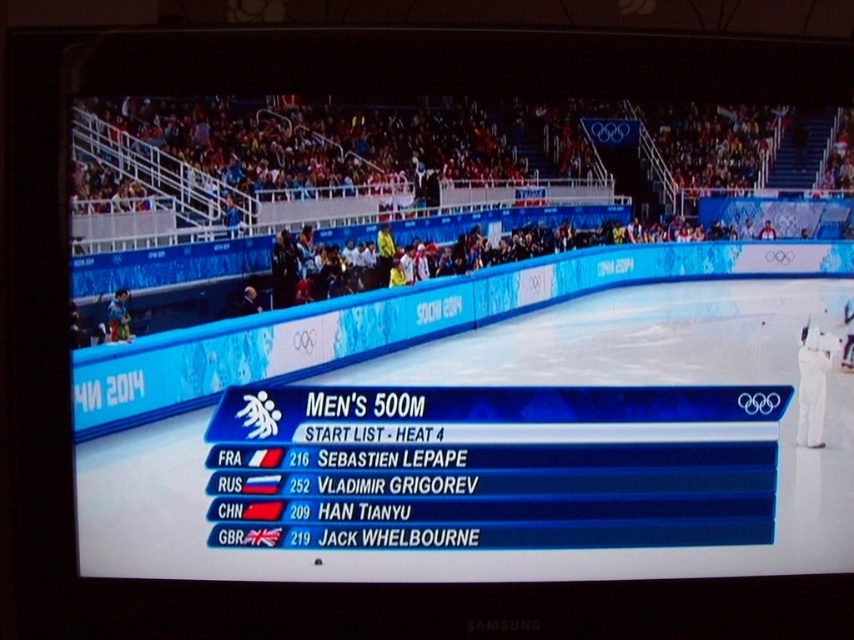
Question: Is white glossy scoreboard at center further to the viewer compared to white cotton pants at right?

Choices:
 (A) no
 (B) yes

Answer: (A)

Question: Is white glossy scoreboard at center below white cotton pants at right?

Choices:
 (A) no
 (B) yes

Answer: (A)

Question: Which object is closer to the camera taking this photo?

Choices:
 (A) white glossy scoreboard at center
 (B) white cotton pants at right

Answer: (A)

Question: Which of the following is the farthest from the observer?

Choices:
 (A) [x=812, y=362]
 (B) [x=607, y=250]

Answer: (A)

Question: In this image, where is white glossy scoreboard at center located relative to white cotton pants at right?

Choices:
 (A) below
 (B) above

Answer: (B)